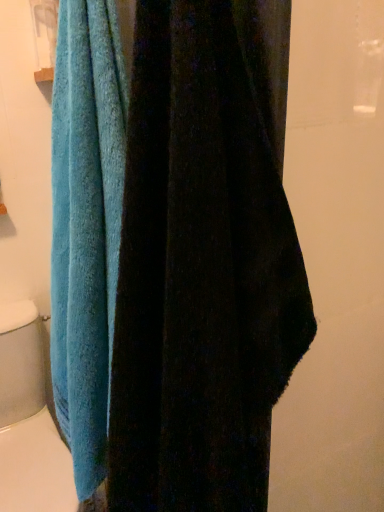
What do you see at coordinates (204, 260) in the screenshot? The height and width of the screenshot is (512, 384). I see `blue terry cloth towel at left` at bounding box center [204, 260].

Identify the location of blue terry cloth towel at left. (204, 260).

This screenshot has height=512, width=384. In order to click on blue terry cloth towel at left in this screenshot , I will do `click(204, 260)`.